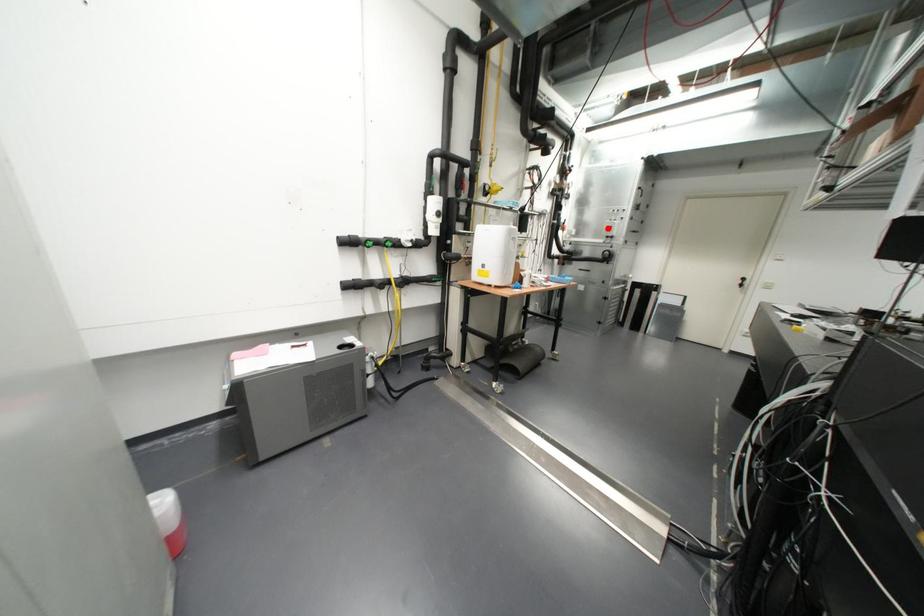
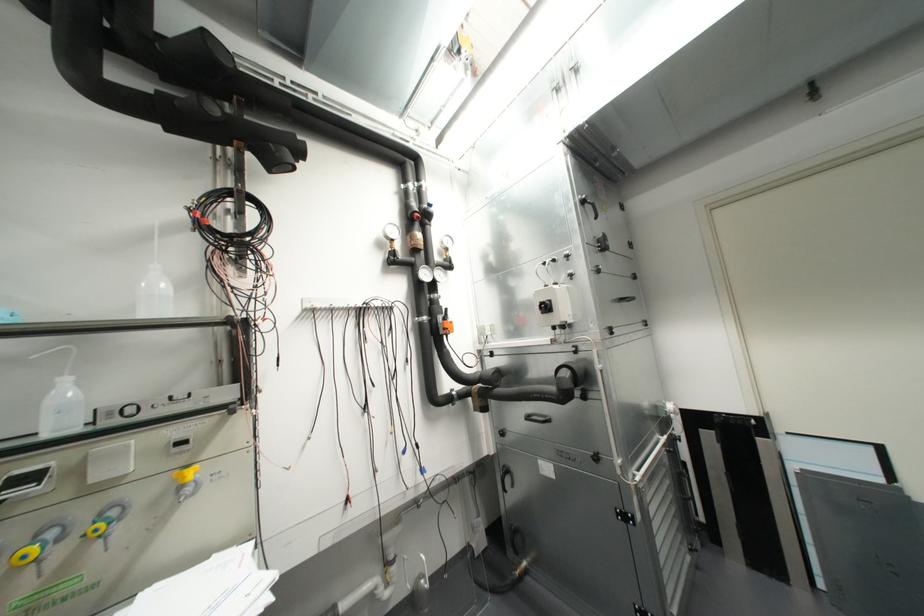
Question: A red point is marked in image1. In image2, is the corresponding 3D point closer to the camera or farther? Reply with the corresponding letter.

Choices:
 (A) The corresponding 3D point is closer.
 (B) The corresponding 3D point is farther.

Answer: (B)